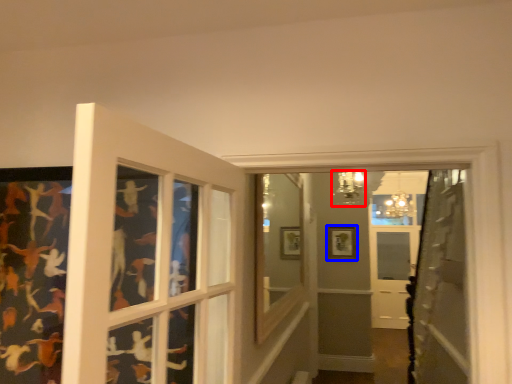
Question: Which of the following is the closest to the observer, light fixture (highlighted by a red box) or picture frame (highlighted by a blue box)?

Choices:
 (A) light fixture
 (B) picture frame

Answer: (A)